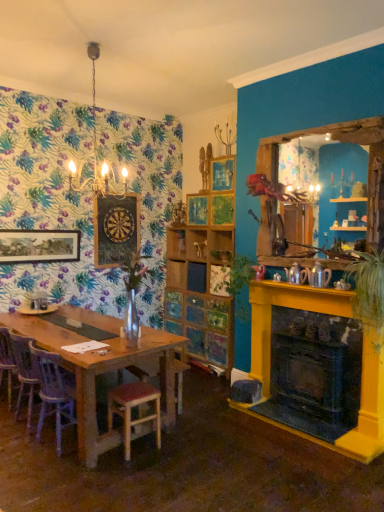
Measure the distance between wooden mirror at right and camera.

wooden mirror at right is 3.16 meters from camera.

Measure the distance between pine wood stool at lower left and camera.

3.04 meters.

What do you see at coordinates (115, 228) in the screenshot? This screenshot has width=384, height=512. I see `wooden dartboard at upper left, the 1th picture frame in the right-to-left sequence` at bounding box center [115, 228].

Describe the element at coordinates (176, 243) in the screenshot. The image size is (384, 512). I see `wooden shelf at center` at that location.

How much space does green leafy plant at right, which is counted as the second plant, starting from the back, occupy vertically?

The height of green leafy plant at right, which is counted as the second plant, starting from the back, is 34.22 inches.

Identify the location of wooden at left, acting as the first chair starting from the back. This screenshot has height=512, width=384. (24, 372).

From a real-world perspective, is wooden shelf at center under wooden at left, placed as the 1th chair when sorted from front to back?

Actually, wooden shelf at center is physically above wooden at left, placed as the 1th chair when sorted from front to back, in the real world.

Is wooden shelf at center facing away from wooden at left, placed as the 1th chair when sorted from front to back?

No, wooden shelf at center is not facing the opposite direction of wooden at left, placed as the 1th chair when sorted from front to back.

Is wooden shelf at center far from wooden at left, placed as the 1th chair when sorted from front to back?

Absolutely, wooden shelf at center is distant from wooden at left, placed as the 1th chair when sorted from front to back.

Does wooden shelf at center have a greater width compared to wooden at left, placed as the 1th chair when sorted from front to back?

In fact, wooden shelf at center might be narrower than wooden at left, placed as the 1th chair when sorted from front to back.

Is matte black picture frame at upper left, the first picture frame from the left, facing away from wooden dartboard at upper left, acting as the 2th picture frame starting from the left?

No, wooden dartboard at upper left, acting as the 2th picture frame starting from the left, is not at the back of matte black picture frame at upper left, the first picture frame from the left.

Is matte black picture frame at upper left, marked as the second picture frame in a back-to-front arrangement, not inside wooden dartboard at upper left, the 1th picture frame in the right-to-left sequence?

Yes.

Which is in front, point (6, 233) or point (107, 200)?

The point (107, 200) is more forward.

Where is `chair that is the 1st object directly below the metallic yellow fireplace at right (from a real-world perspective)`? chair that is the 1st object directly below the metallic yellow fireplace at right (from a real-world perspective) is located at coordinates (24, 372).

Is metallic yellow fireplace at right wider or thinner than wooden at left, which is counted as the 2th chair, starting from the front?

Considering their sizes, metallic yellow fireplace at right looks slimmer than wooden at left, which is counted as the 2th chair, starting from the front.

Between metallic yellow fireplace at right and wooden at left, acting as the first chair starting from the back, which one has less height?

Standing shorter between the two is wooden at left, acting as the first chair starting from the back.

Can you see metallic yellow fireplace at right touching wooden at left, which is counted as the 2th chair, starting from the front?

No, metallic yellow fireplace at right is not in contact with wooden at left, which is counted as the 2th chair, starting from the front.

Is wooden mirror at right in front of or behind metallic yellow fireplace at right in the image?

wooden mirror at right is in front of metallic yellow fireplace at right.

Considering the relative positions of wooden mirror at right and metallic yellow fireplace at right in the image provided, is wooden mirror at right to the left or to the right of metallic yellow fireplace at right?

wooden mirror at right is positioned on metallic yellow fireplace at right's right side.

Find the location of a particular element. The height and width of the screenshot is (512, 384). mirror in front of the metallic yellow fireplace at right is located at coordinates (328, 183).

In the scene shown: How many degrees apart are the facing directions of wooden mirror at right and metallic yellow fireplace at right?

0.765 degrees separate the facing orientations of wooden mirror at right and metallic yellow fireplace at right.

Considering the sizes of objects matte black picture frame at upper left, marked as the second picture frame in a back-to-front arrangement, and wooden mirror at right in the image provided, who is shorter, matte black picture frame at upper left, marked as the second picture frame in a back-to-front arrangement, or wooden mirror at right?

matte black picture frame at upper left, marked as the second picture frame in a back-to-front arrangement.

How different are the orientations of matte black picture frame at upper left, acting as the 1th picture frame starting from the front, and wooden mirror at right in degrees?

The facing directions of matte black picture frame at upper left, acting as the 1th picture frame starting from the front, and wooden mirror at right are 90.4 degrees apart.

Is point (9, 231) closer to viewer compared to point (325, 166)?

That is False.

Is matte black picture frame at upper left, which is counted as the 2th picture frame, starting from the right, far from wooden mirror at right?

matte black picture frame at upper left, which is counted as the 2th picture frame, starting from the right, is far away from wooden mirror at right.

Considering the sizes of pine wood stool at lower left and wooden at left, which is the 2th chair in back-to-front order, in the image, is pine wood stool at lower left wider or thinner than wooden at left, which is the 2th chair in back-to-front order,?

Clearly, pine wood stool at lower left has less width compared to wooden at left, which is the 2th chair in back-to-front order.

From a real-world perspective, between pine wood stool at lower left and wooden at left, placed as the 1th chair when sorted from front to back, who is vertically higher?

From a 3D spatial view, wooden at left, placed as the 1th chair when sorted from front to back, is above.

Would you say pine wood stool at lower left is to the left or to the right of wooden at left, which is the 2th chair in back-to-front order, in the picture?

Clearly, pine wood stool at lower left is on the right of wooden at left, which is the 2th chair in back-to-front order, in the image.

From the image's perspective, which one is positioned higher, pine wood stool at lower left or wooden at left, which is the 2th chair in back-to-front order?

wooden at left, which is the 2th chair in back-to-front order, appears higher in the image.

Does white porcelain plate at left have a larger size compared to green leafy plant at center, which is counted as the 2th plant, starting from the right?

Incorrect, white porcelain plate at left is not larger than green leafy plant at center, which is counted as the 2th plant, starting from the right.

From the image's perspective, who appears lower, white porcelain plate at left or green leafy plant at center, marked as the 1th plant in a back-to-front arrangement?

white porcelain plate at left, from the image's perspective.

How different are the orientations of white porcelain plate at left and green leafy plant at center, which is counted as the 2th plant, starting from the right, in degrees?

The angle between the facing direction of white porcelain plate at left and the facing direction of green leafy plant at center, which is counted as the 2th plant, starting from the right, is 89.5 degrees.

Find the location of `the 2nd chair below when counting from the wooden shelf at center (from the image's perspective)`. the 2nd chair below when counting from the wooden shelf at center (from the image's perspective) is located at coordinates (53, 393).

Identify the location of picture frame in front of the wooden dartboard at upper left, acting as the 2th picture frame starting from the left. (39, 246).

Looking at the image, which one is located closer to metallic yellow fireplace at right, white porcelain plate at left or wooden mirror at right?

Based on the image, wooden mirror at right appears to be nearer to metallic yellow fireplace at right.

Estimate the real-world distances between objects in this image. Which object is further from wooden mirror at right, wooden shelf at center or wooden at left, acting as the first chair starting from the back?

wooden at left, acting as the first chair starting from the back.

Estimate the real-world distances between objects in this image. Which object is further from white porcelain plate at left, green leafy plant at right, which ranks as the first plant in right-to-left order, or green leafy plant at center, the second plant positioned from the front?

Among the two, green leafy plant at right, which ranks as the first plant in right-to-left order, is located further to white porcelain plate at left.

Estimate the real-world distances between objects in this image. Which object is closer to wooden shelf at center, green leafy plant at center, the second plant positioned from the front, or white porcelain plate at left?

green leafy plant at center, the second plant positioned from the front, is closer to wooden shelf at center.

In the scene shown: Based on their spatial positions, is metallic yellow fireplace at right or wooden dartboard at upper left, the first picture frame from the back, closer to metallic chandelier at upper center?

Based on the image, wooden dartboard at upper left, the first picture frame from the back, appears to be nearer to metallic chandelier at upper center.

Estimate the real-world distances between objects in this image. Which object is closer to wooden dartboard at upper left, the first picture frame from the back, wooden shelf at center or white porcelain plate at left?

The object closer to wooden dartboard at upper left, the first picture frame from the back, is white porcelain plate at left.

Looking at the image, which one is located further to metallic yellow fireplace at right, pine wood stool at lower left or wooden shelf at center?

The object further to metallic yellow fireplace at right is wooden shelf at center.

Estimate the real-world distances between objects in this image. Which object is further from wooden at left, acting as the first chair starting from the back, metallic yellow fireplace at right or white porcelain plate at left?

Among the two, metallic yellow fireplace at right is located further to wooden at left, acting as the first chair starting from the back.

You are a GUI agent. You are given a task and a screenshot of the screen. Output one action in this format:
    pyautogui.click(x=<x>, y=<y>)
    Task: Click on the fireplace that lies between metallic chandelier at upper center and wooden at left, placed as the 1th chair when sorted from front to back, from top to bottom
    
    Given the screenshot: What is the action you would take?
    pyautogui.click(x=319, y=365)

What are the coordinates of `picture frame between wooden dartboard at upper left, which is the 2th picture frame from front to back, and white porcelain plate at left vertically` in the screenshot? It's located at (39, 246).

The height and width of the screenshot is (512, 384). I want to click on fireplace between wooden at left, placed as the 1th chair when sorted from front to back, and wooden dartboard at upper left, which is the 2th picture frame from front to back, from front to back, so click(319, 365).

Where is `tableware between matte black picture frame at upper left, the first picture frame from the left, and green leafy plant at right, which ranks as the first plant in right-to-left order, from left to right`? The height and width of the screenshot is (512, 384). tableware between matte black picture frame at upper left, the first picture frame from the left, and green leafy plant at right, which ranks as the first plant in right-to-left order, from left to right is located at coordinates (36, 310).